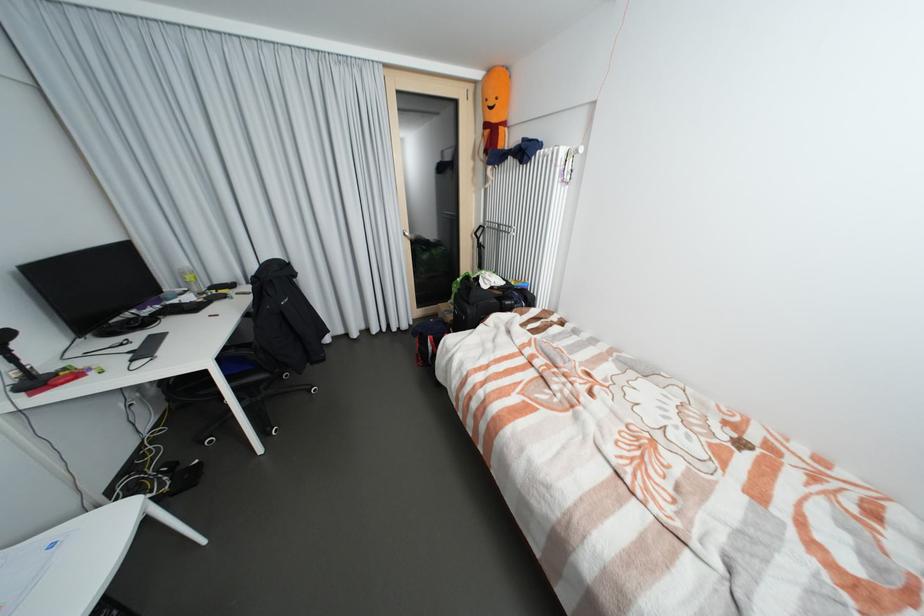
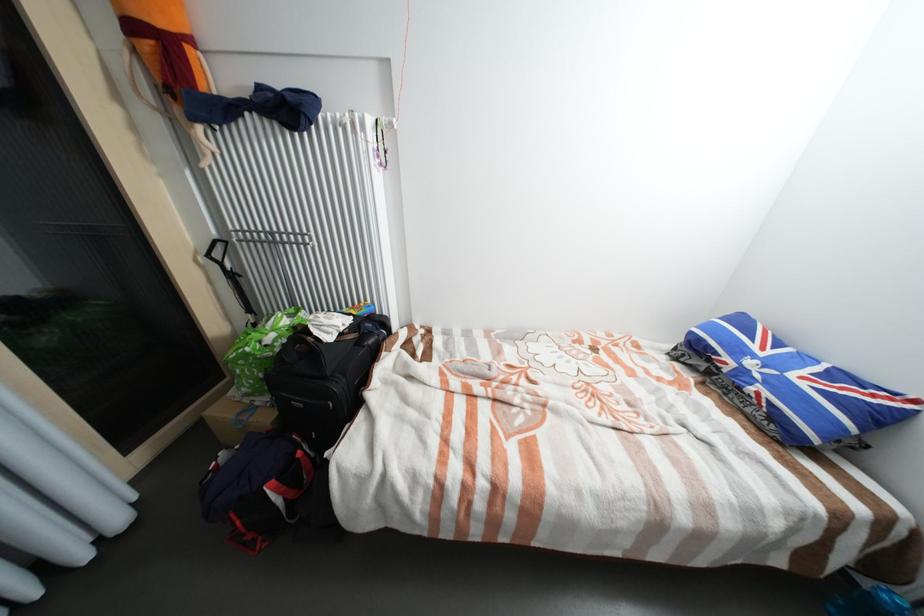
Question: Based on the continuous images, in which direction is the camera rotating? Reply with the corresponding letter.

Choices:
 (A) Left
 (B) Right
 (C) Up
 (D) Down

Answer: (B)